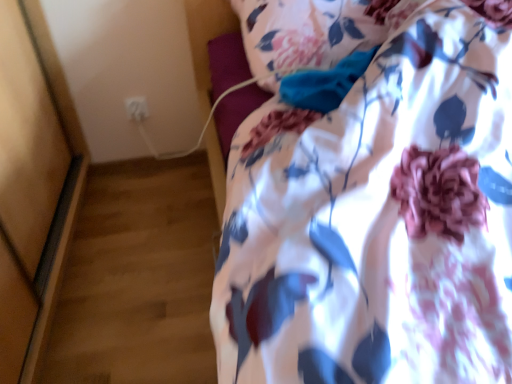
Question: Relative to white plastic electric outlet at upper left, is floral fabric pillow at upper center in front or behind?

Choices:
 (A) behind
 (B) front

Answer: (B)

Question: From the image's perspective, is floral fabric pillow at upper center positioned above or below white plastic electric outlet at upper left?

Choices:
 (A) above
 (B) below

Answer: (A)

Question: In terms of width, does floral fabric pillow at upper center look wider or thinner when compared to white plastic electric outlet at upper left?

Choices:
 (A) thin
 (B) wide

Answer: (B)

Question: From their relative heights in the image, would you say white plastic electric outlet at upper left is taller or shorter than floral fabric pillow at upper center?

Choices:
 (A) short
 (B) tall

Answer: (A)

Question: Is white plastic electric outlet at upper left inside the boundaries of floral fabric pillow at upper center, or outside?

Choices:
 (A) inside
 (B) outside

Answer: (B)

Question: In the image, is white plastic electric outlet at upper left positioned in front of or behind floral fabric pillow at upper center?

Choices:
 (A) behind
 (B) front

Answer: (A)

Question: Does point (143, 107) appear closer or farther from the camera than point (368, 43)?

Choices:
 (A) closer
 (B) farther

Answer: (B)